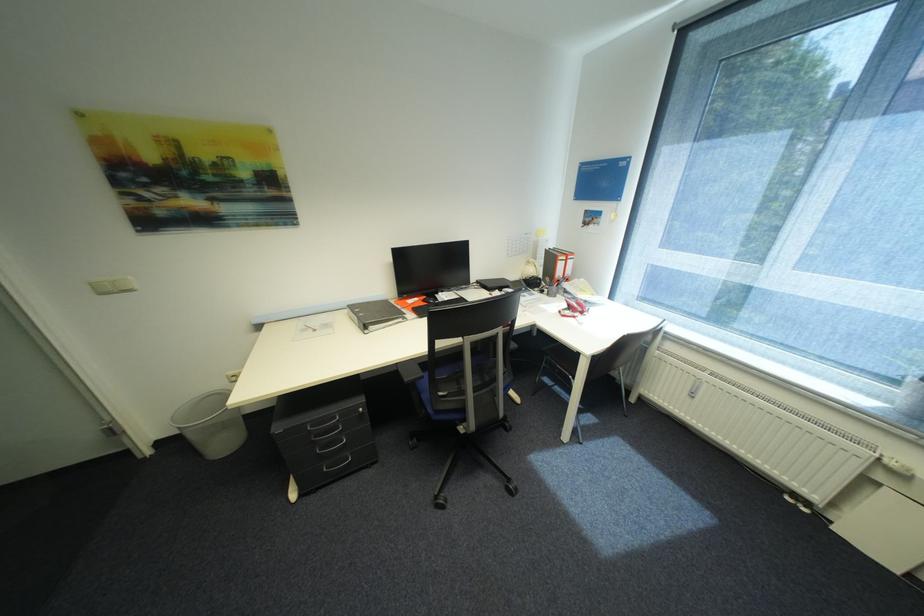
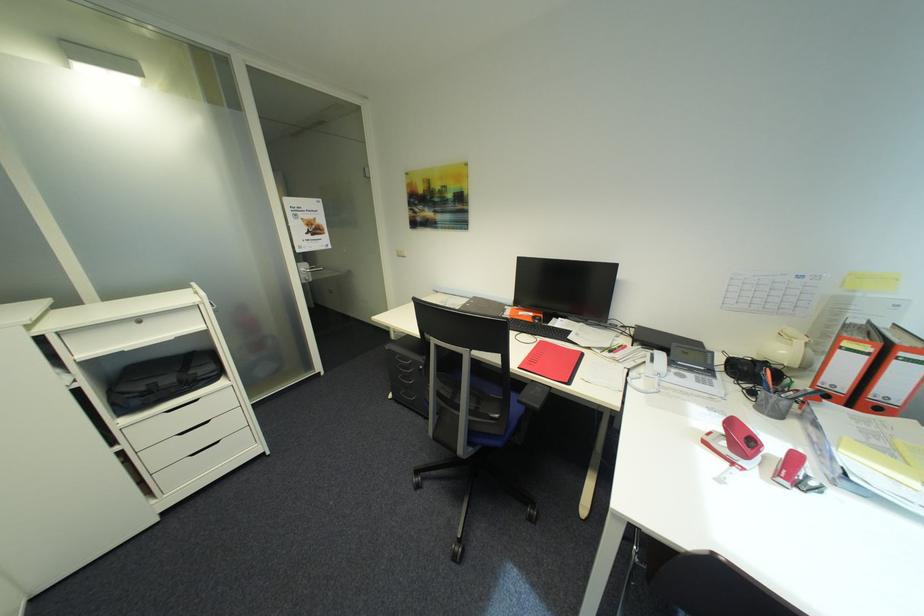
In the second image, find the point that corresponds to point (550, 292) in the first image.

(760, 392)